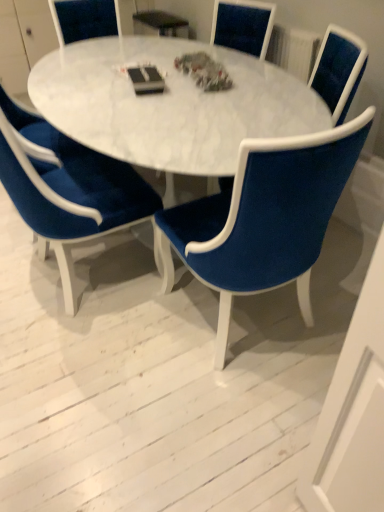
The width and height of the screenshot is (384, 512). I want to click on vacant space to the right of velvet blue chair at center, the 2th chair from the right, so click(x=327, y=297).